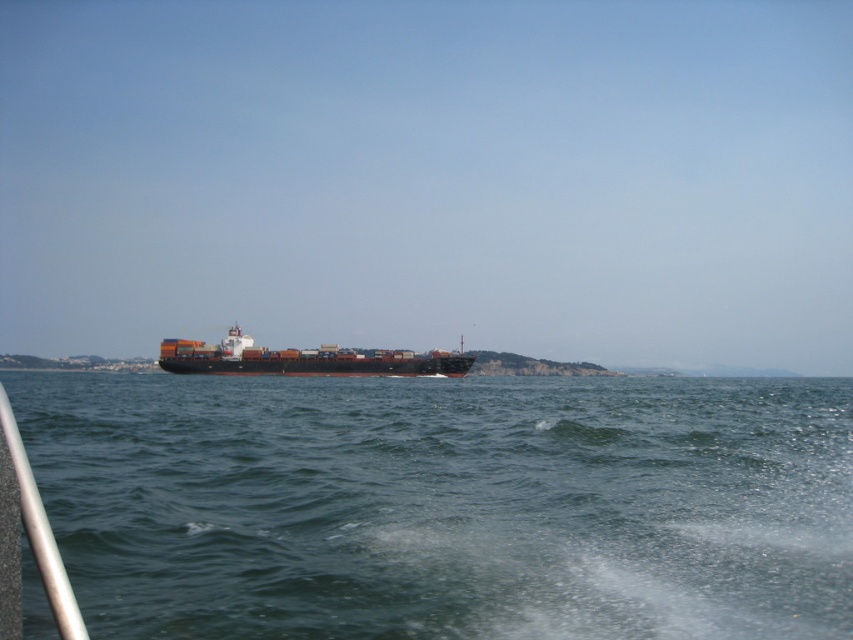
You are a photographer planning to capture the entire scene of the green water at center and the brown matte container ship at center in one shot. Based on their sizes, which object should you focus on to ensure both are clearly visible in the frame?

The green water at center is bigger than the brown matte container ship at center, so focusing on the green water at center would ensure both objects are clearly visible since it occupies more space in the frame.

Looking at this image, you are a drone operator tasked with capturing aerial footage of the green water at center and the brown matte container ship at center. Your drone has a maximum flight range of 30 meters. Can you safely capture footage of both objects without exceeding the drone range?

The distance between the green water at center and the brown matte container ship at center is 28.70 meters. Since the drone has a maximum flight range of 30 meters, it can safely capture footage of both objects without exceeding its range.